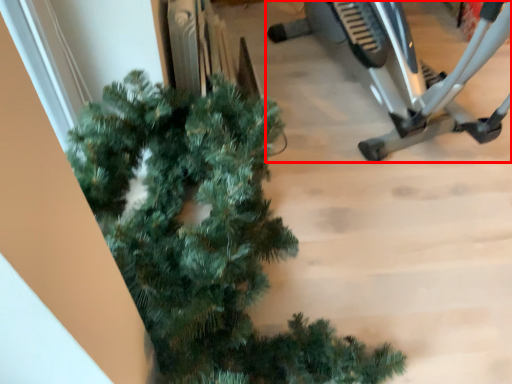
Question: Considering the relative positions of stationary bicycle (annotated by the red box) and christmas tree in the image provided, where is stationary bicycle (annotated by the red box) located with respect to the staircase?

Choices:
 (A) left
 (B) right

Answer: (B)